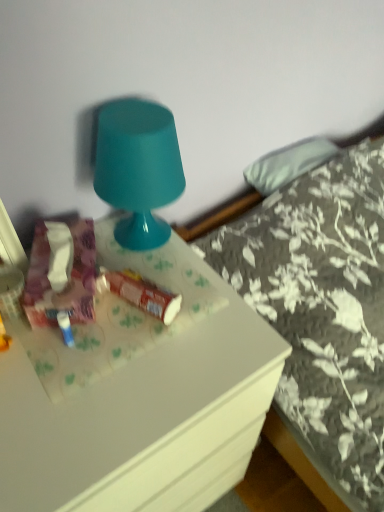
At what (x,y) coordinates should I click in order to perform the action: click on vacant area that is in front of matte floral tissue box at left, the second stuff from the right. Please return your answer as a coordinate pair (x, y). This screenshot has width=384, height=512. Looking at the image, I should click on (73, 364).